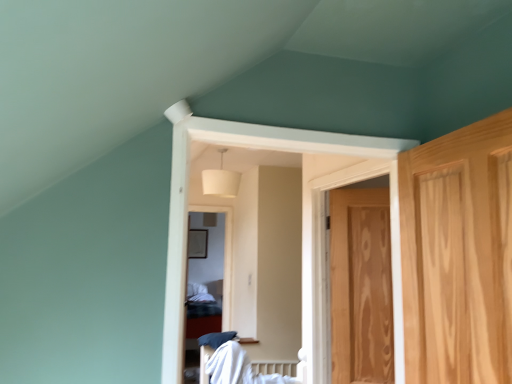
Question: Is point (227, 177) closer or farther from the camera than point (224, 365)?

Choices:
 (A) farther
 (B) closer

Answer: (A)

Question: Is white fabric lampshade at upper center inside or outside of white cotton bed at center?

Choices:
 (A) outside
 (B) inside

Answer: (A)

Question: Which object is the farthest from the wooden door at right?

Choices:
 (A) white cotton bed at center
 (B) white fabric lampshade at upper center

Answer: (B)

Question: Based on their relative distances, which object is nearer to the white cotton bed at center?

Choices:
 (A) wooden door at right
 (B) white fabric lampshade at upper center

Answer: (A)